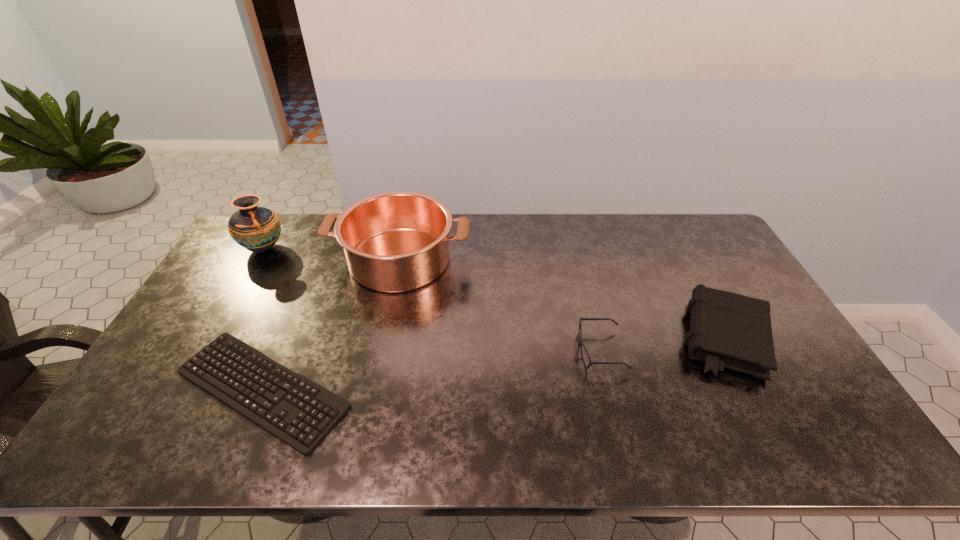
Where is `vacant space positioned 0.130m on the front-facing side of the second object from right to left`? vacant space positioned 0.130m on the front-facing side of the second object from right to left is located at coordinates (529, 351).

This screenshot has height=540, width=960. In order to click on free location located on the front-facing side of the second object from right to left in this screenshot , I will do `click(547, 351)`.

I want to click on vacant space positioned on the front-facing side of the second object from right to left, so click(x=489, y=351).

Identify the location of free space located 0.400m on the back of the shortest object. (323, 248).

Locate an element on the screen. Image resolution: width=960 pixels, height=540 pixels. pottery that is at the far edge is located at coordinates (257, 229).

You are a GUI agent. You are given a task and a screenshot of the screen. Output one action in this format:
    pyautogui.click(x=<x>, y=<y>)
    Task: Click on the saucepan at the far edge
    The height and width of the screenshot is (540, 960).
    Given the screenshot: What is the action you would take?
    pyautogui.click(x=398, y=241)

Locate an element on the screen. object present at the near edge is located at coordinates (325, 401).

The width and height of the screenshot is (960, 540). I want to click on pottery that is positioned at the left edge, so click(x=257, y=229).

Identify the location of computer keyboard at the left edge. The height and width of the screenshot is (540, 960). (325, 401).

I want to click on object that is positioned at the right edge, so click(727, 330).